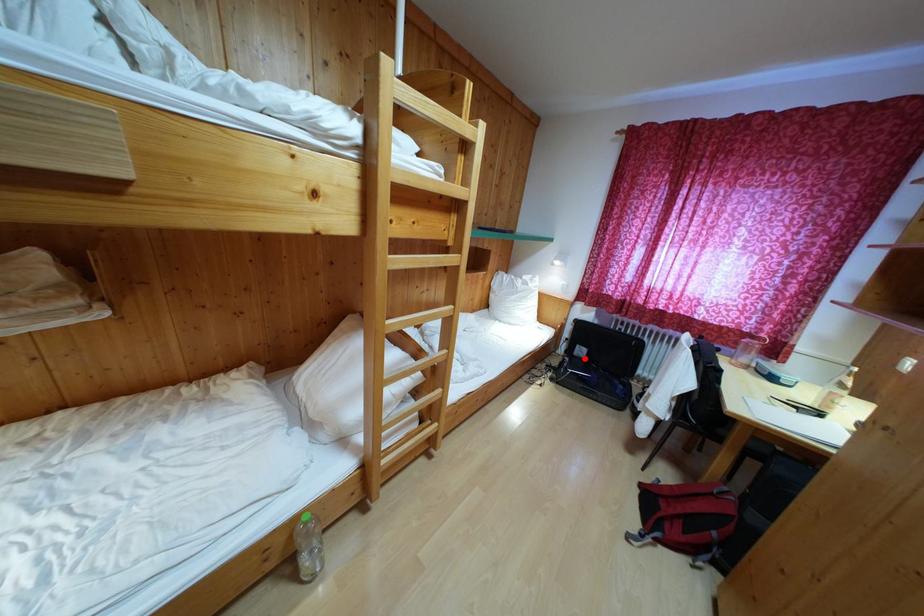
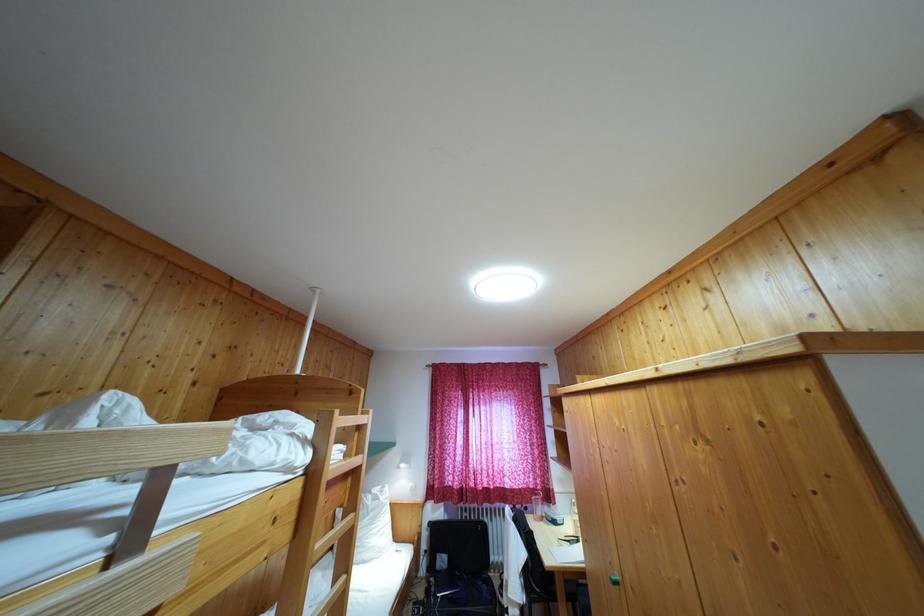
In the second image, find the point that corresponds to the highlighted location in the first image.

(445, 567)